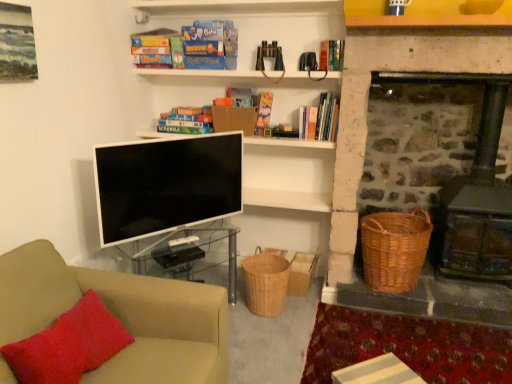
Locate an element on the screen. vacant area that lies between woven brown basket at lower center, the third basket from the right, and white striped paper at lower right is located at coordinates (283, 330).